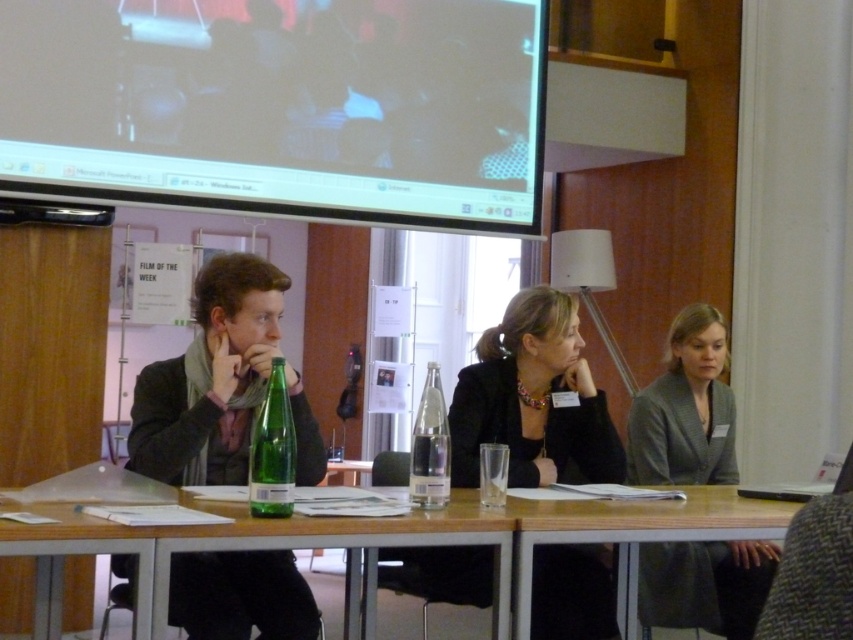
Can you confirm if matte black projector screen at upper center is positioned to the left of clear glass bottle at center?

Correct, you'll find matte black projector screen at upper center to the left of clear glass bottle at center.

The image size is (853, 640). Describe the element at coordinates (281, 106) in the screenshot. I see `matte black projector screen at upper center` at that location.

At what (x,y) coordinates should I click in order to perform the action: click on matte black projector screen at upper center. Please return your answer as a coordinate pair (x, y). Looking at the image, I should click on (281, 106).

Which is above, matte black jacket at center or dark gray suit at center?

dark gray suit at center is higher up.

Can you confirm if matte black jacket at center is wider than dark gray suit at center?

Yes.

Does point (213, 602) come closer to viewer compared to point (733, 595)?

Yes, it is.

Identify the location of matte black jacket at center. This screenshot has width=853, height=640. (210, 378).

Between dark gray suit at center and green glass bottle at center, which one appears on the left side from the viewer's perspective?

Positioned to the left is green glass bottle at center.

Which of these two, dark gray suit at center or green glass bottle at center, stands taller?

With more height is dark gray suit at center.

Is point (647, 426) positioned behind point (267, 390)?

That is True.

Identify the location of dark gray suit at center. (685, 408).